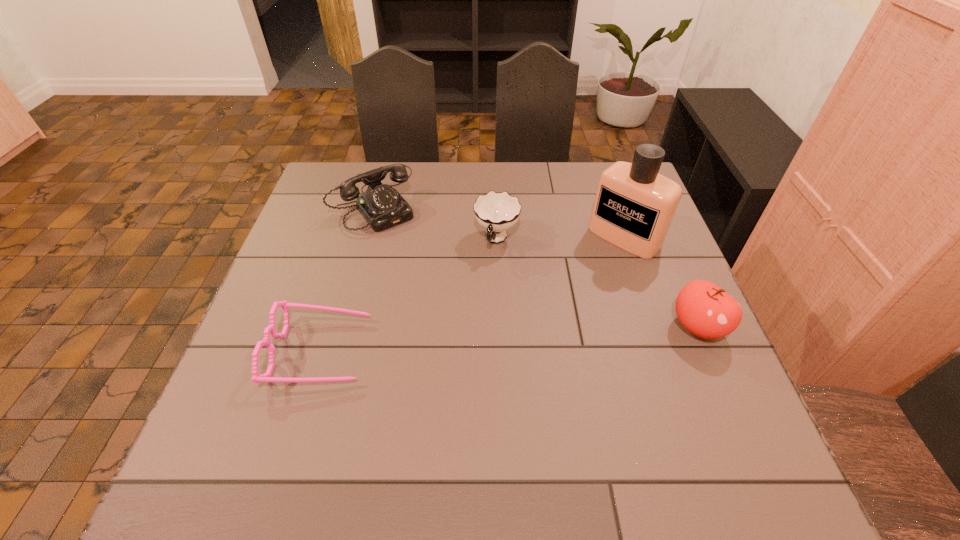
Identify the location of object that is the third closest one to the telephone. (634, 206).

Identify the location of vacant area that satisfies the following two spatial constraints: 1. on the front side of the apple; 2. on the right side of the tallest object. The width and height of the screenshot is (960, 540). (656, 327).

The image size is (960, 540). What are the coordinates of `free location that satisfies the following two spatial constraints: 1. on the front side of the tallest object; 2. on the left side of the telephone` in the screenshot? It's located at (366, 238).

I want to click on free location that satisfies the following two spatial constraints: 1. on the back side of the tallest object; 2. on the left side of the cup, so click(496, 238).